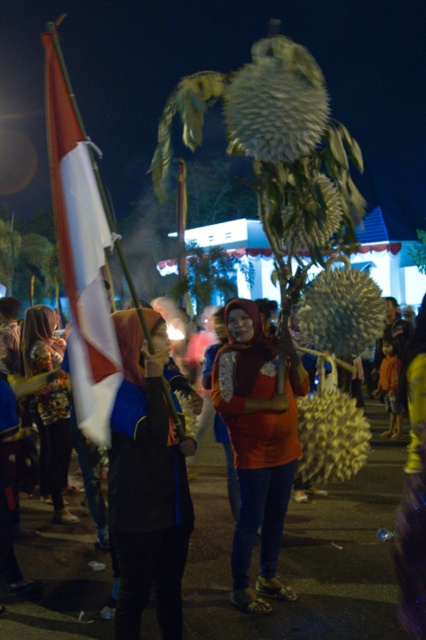
Which is more to the right, matte orange hijab at center or printed fabric hijab at left?

matte orange hijab at center

Consider the image. Measure the distance from matte orange hijab at center to printed fabric hijab at left.

matte orange hijab at center is 2.51 meters away from printed fabric hijab at left.

Find the location of `matte orange hijab at center`. matte orange hijab at center is located at coordinates (304, 554).

In the scene shown: Is matte orange hijab at center positioned behind dark blue fabric jacket at center?

Yes, matte orange hijab at center is behind dark blue fabric jacket at center.

Find the location of a particular element. The width and height of the screenshot is (426, 640). matte orange hijab at center is located at coordinates (304, 554).

Between matte orange hijab at center and red-white striped flag at left, which one is positioned lower?

matte orange hijab at center is lower down.

Does matte orange hijab at center have a smaller size compared to red-white striped flag at left?

Yes, matte orange hijab at center is smaller than red-white striped flag at left.

Is point (273, 609) positioned behind point (46, 61)?

Yes.

Image resolution: width=426 pixels, height=640 pixels. I want to click on matte orange hijab at center, so click(304, 554).